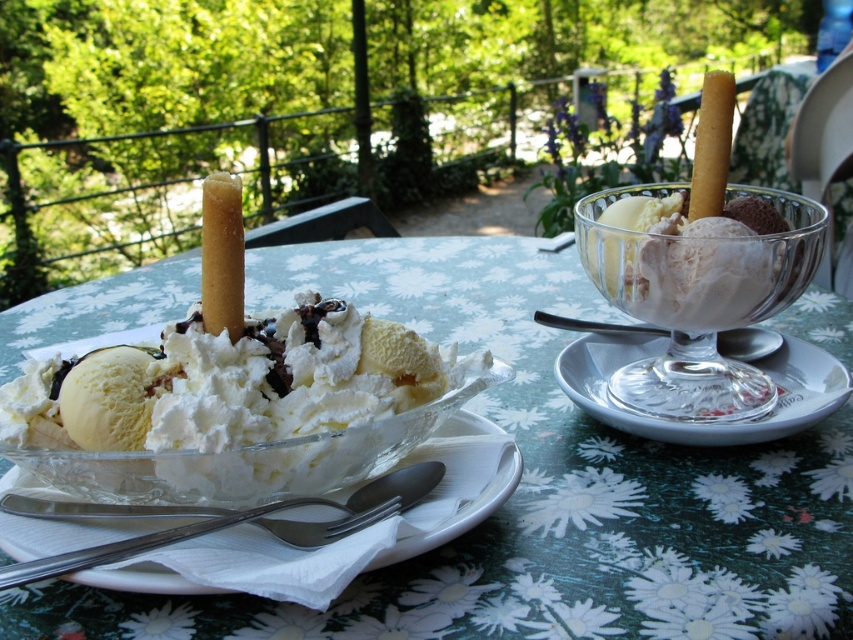
Question: Does clear glass bowl at center have a smaller size compared to soft vanilla ice cream at left?

Choices:
 (A) no
 (B) yes

Answer: (A)

Question: Estimate the real-world distances between objects in this image. Which object is farther from the white porcelain plate at center?

Choices:
 (A) clear glass bowl at center
 (B) transparent glass bowl at center right

Answer: (A)

Question: Based on their relative distances, which object is nearer to the clear glass bowl at center?

Choices:
 (A) soft vanilla ice cream at left
 (B) white glass saucer at right

Answer: (B)

Question: Which of the following is the closest to the observer?

Choices:
 (A) white porcelain plate at center
 (B) soft vanilla ice cream at left
 (C) clear glass bowl at center
 (D) white glass saucer at right

Answer: (A)

Question: Does clear glass bowl at center appear under white glass saucer at right?

Choices:
 (A) no
 (B) yes

Answer: (A)

Question: Can you confirm if transparent glass bowl at center right is positioned to the left of white glass saucer at right?

Choices:
 (A) no
 (B) yes

Answer: (B)